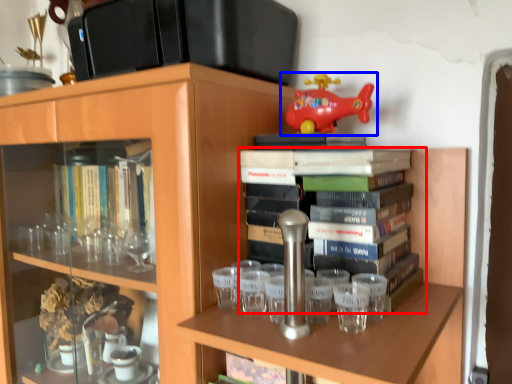
Question: Which object is closer to the camera taking this photo, book (highlighted by a red box) or toy (highlighted by a blue box)?

Choices:
 (A) book
 (B) toy

Answer: (A)